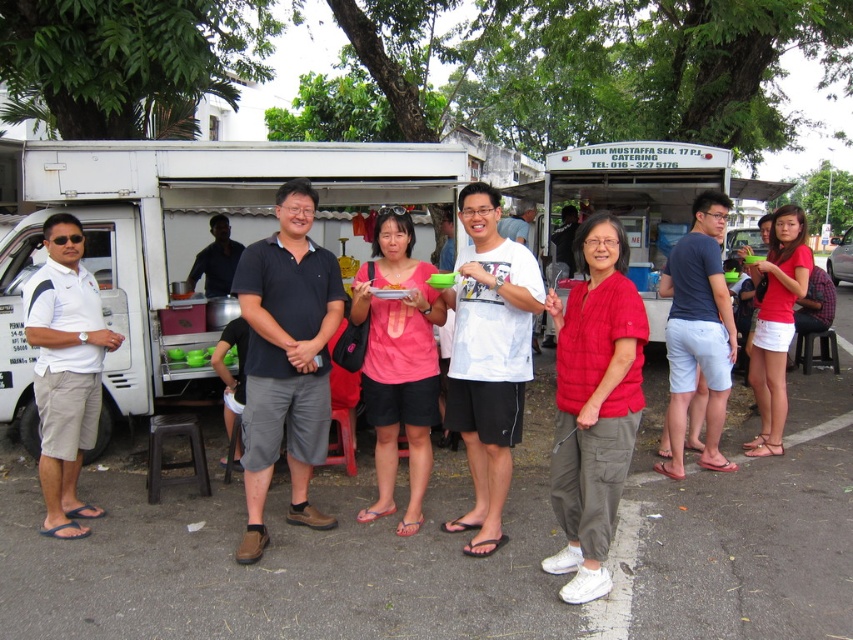
Find the location of a particular element. The image size is (853, 640). white cotton t-shirt at center is located at coordinates (489, 358).

What are the coordinates of `white cotton t-shirt at center` in the screenshot? It's located at (489, 358).

Identify the location of white cotton t-shirt at center. The image size is (853, 640). (489, 358).

Based on the photo, can you confirm if white cotton shirt at left is taller than red matte shorts at lower right?

No, white cotton shirt at left is not taller than red matte shorts at lower right.

Looking at this image, who is more forward, (96,349) or (791,230)?

Point (96,349) is more forward.

Who is more forward, (102, 320) or (786, 308)?

Point (102, 320)

Image resolution: width=853 pixels, height=640 pixels. Find the location of `white cotton shirt at left`. white cotton shirt at left is located at coordinates (65, 371).

Is dark blue cotton polo shirt at center to the left of white cotton t-shirt at center from the viewer's perspective?

Correct, you'll find dark blue cotton polo shirt at center to the left of white cotton t-shirt at center.

Does point (254, 499) lie in front of point (527, 342)?

No.

Locate an element on the screen. dark blue cotton polo shirt at center is located at coordinates (286, 358).